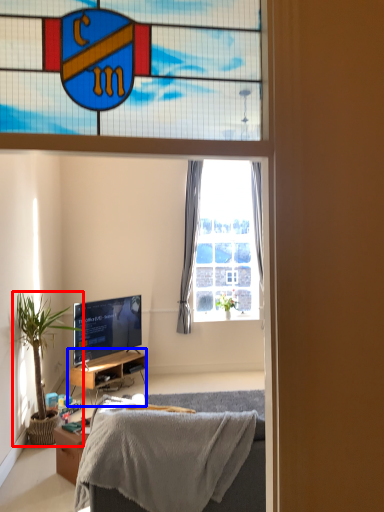
Question: Which point is closer to the camera, houseplant (highlighted by a red box) or cabinetry (highlighted by a blue box)?

Choices:
 (A) houseplant
 (B) cabinetry

Answer: (A)